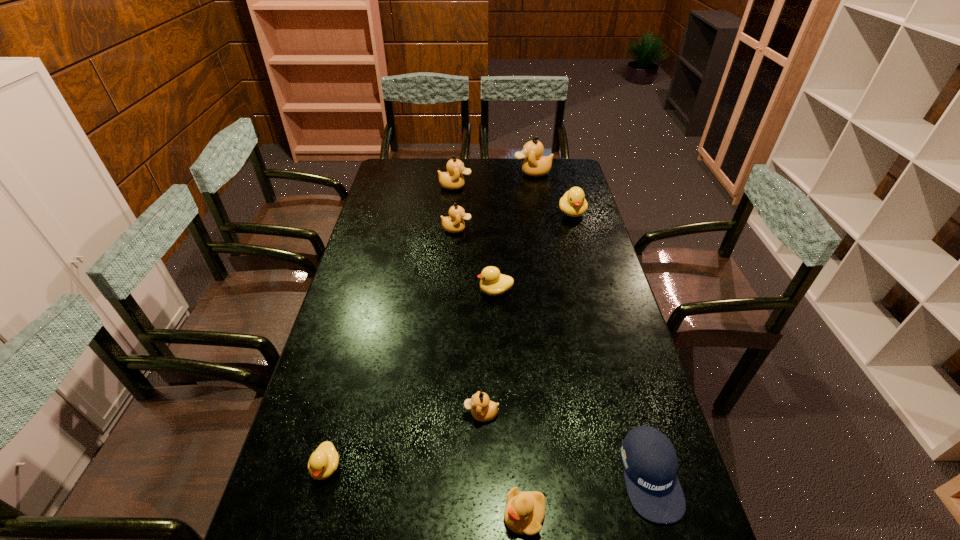
Where is `duckling that is the third nearest to the biggest yellow duckling`? The width and height of the screenshot is (960, 540). duckling that is the third nearest to the biggest yellow duckling is located at coordinates (453, 179).

At what (x,y) coordinates should I click in order to perform the action: click on tan duckling that is the second closest one to the third nearest tan duckling. Please return your answer as a coordinate pair (x, y). Looking at the image, I should click on 454,223.

Where is `the second closest tan duckling relative to the fourth nearest object`? This screenshot has height=540, width=960. the second closest tan duckling relative to the fourth nearest object is located at coordinates (453, 179).

Select which yellow duckling appears as the third closest to the fourth nearest duckling. Please provide its 2D coordinates. Your answer should be formatted as a tuple, i.e. [(x, y)], where the tuple contains the x and y coordinates of a point satisfying the conditions above.

[(524, 512)]

Select which yellow duckling appears as the third closest to the farthest tan duckling. Please provide its 2D coordinates. Your answer should be formatted as a tuple, i.e. [(x, y)], where the tuple contains the x and y coordinates of a point satisfying the conditions above.

[(324, 460)]

Identify the location of vacant space that satisfies the following two spatial constraints: 1. on the beak of the farthest yellow duckling; 2. on the face of the smallest tan duckling. (628, 414).

You are a GUI agent. You are given a task and a screenshot of the screen. Output one action in this format:
    pyautogui.click(x=<x>, y=<y>)
    Task: Click on the vacant space that satisfies the following two spatial constraints: 1. on the face of the nearest tan duckling; 2. on the beak of the third farthest yellow duckling
    The image size is (960, 540).
    Given the screenshot: What is the action you would take?
    (x=481, y=467)

At what (x,y) coordinates should I click in order to perform the action: click on vacant region that satisfies the following two spatial constraints: 1. on the face of the nearest tan duckling; 2. on the beak of the leftmost duckling. Please return your answer as a coordinate pair (x, y). The height and width of the screenshot is (540, 960). Looking at the image, I should click on (481, 467).